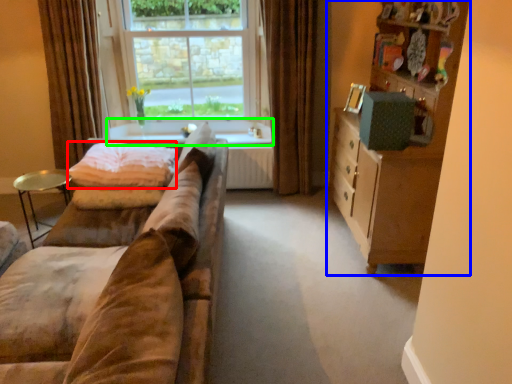
Question: Which object is positioned closest to blanket (highlighted by a red box)? Select from cabinetry (highlighted by a blue box) and window sill (highlighted by a green box).

Choices:
 (A) cabinetry
 (B) window sill

Answer: (B)